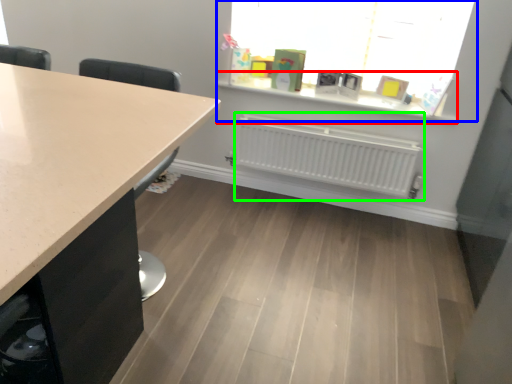
Question: Considering the real-world distances, which object is farthest from window sill (highlighted by a red box)? window (highlighted by a blue box) or radiator (highlighted by a green box)?

Choices:
 (A) window
 (B) radiator

Answer: (B)